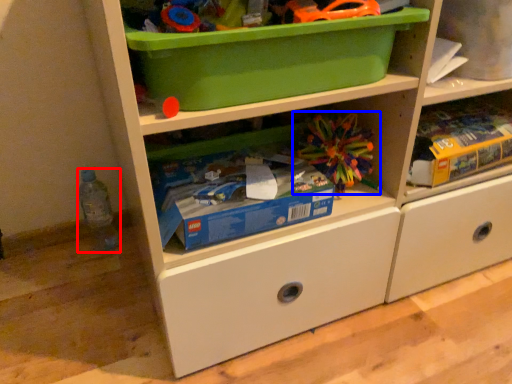
Question: Which of the following is the farthest to the observer, bottle (highlighted by a red box) or toy (highlighted by a blue box)?

Choices:
 (A) bottle
 (B) toy

Answer: (A)